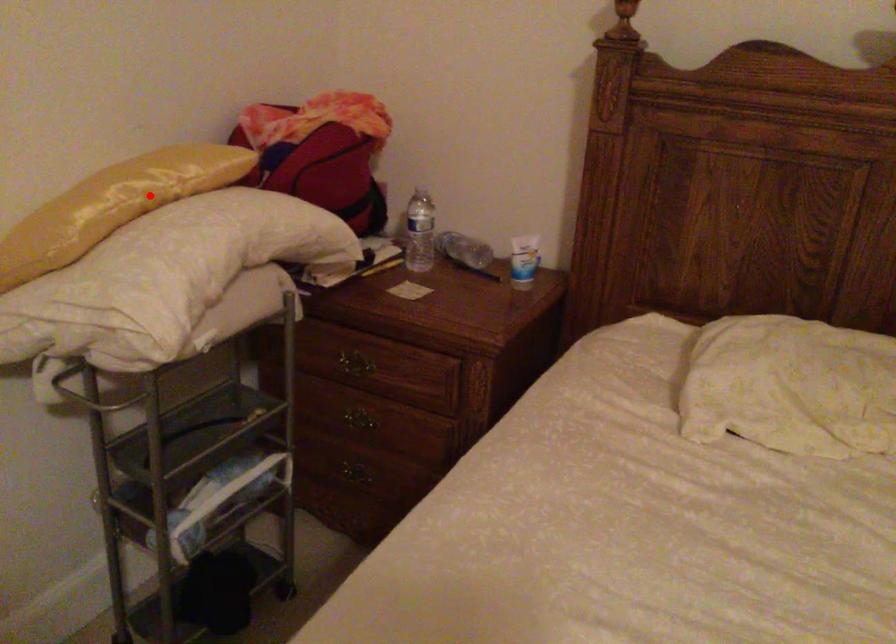
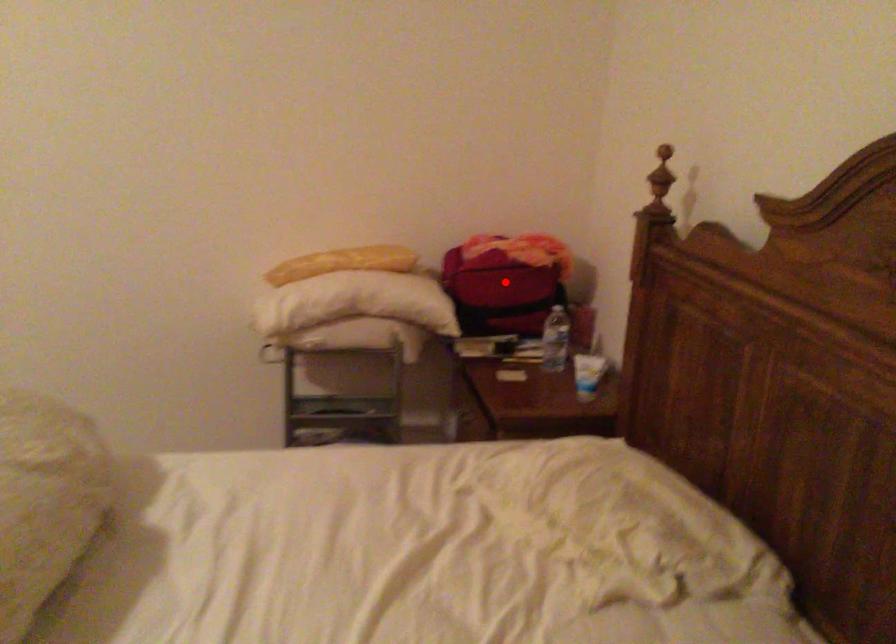
I am providing you with two images of the same scene from different viewpoints. A red point is marked on the first image and another point is marked on the second image. Is the red point in image1 aligned with the point shown in image2?

No